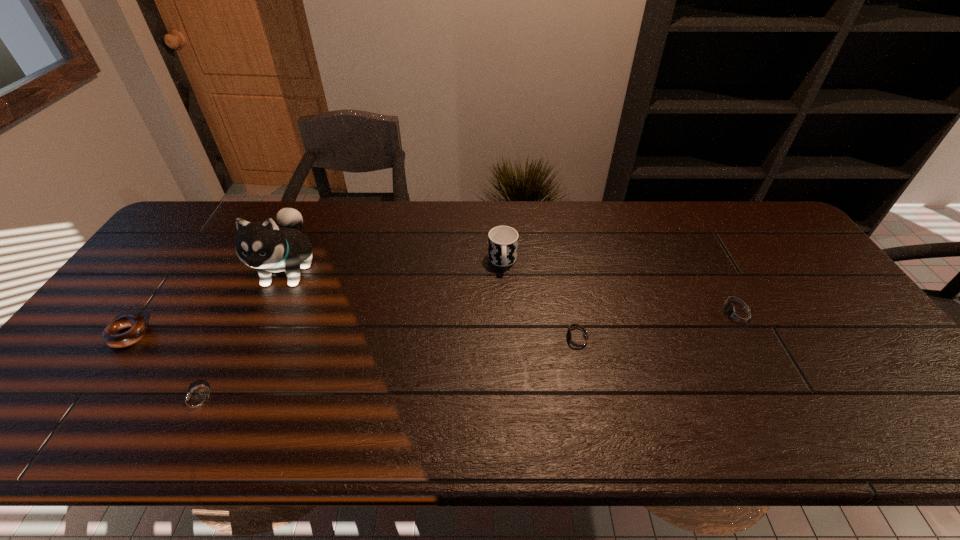
Identify the location of free space located 0.170m on the face of the nearest watch. Image resolution: width=960 pixels, height=540 pixels. (101, 400).

The height and width of the screenshot is (540, 960). Find the location of `free space located 0.230m on the face of the nearest watch`. free space located 0.230m on the face of the nearest watch is located at coordinates (74, 400).

Identify the location of vacant region located on the face of the nearest watch. (69, 400).

The height and width of the screenshot is (540, 960). Identify the location of vacant area located on the face of the second watch from left to right. (482, 340).

In order to click on free region located 0.240m on the face of the second watch from left to right in this screenshot , I will do `click(458, 340)`.

At what (x,y) coordinates should I click in order to perform the action: click on vacant space positioned on the face of the second watch from left to right. Please return your answer as a coordinate pair (x, y). This screenshot has height=540, width=960. Looking at the image, I should click on (469, 340).

The height and width of the screenshot is (540, 960). I want to click on free space located 0.100m on the face of the tallest watch, so click(x=672, y=314).

Locate an element on the screen. free point located 0.210m on the face of the tallest watch is located at coordinates (631, 314).

Locate an element on the screen. vacant space located on the face of the tallest watch is located at coordinates (589, 314).

Image resolution: width=960 pixels, height=540 pixels. Identify the location of free space located on the front of the doughnut. [x=101, y=374].